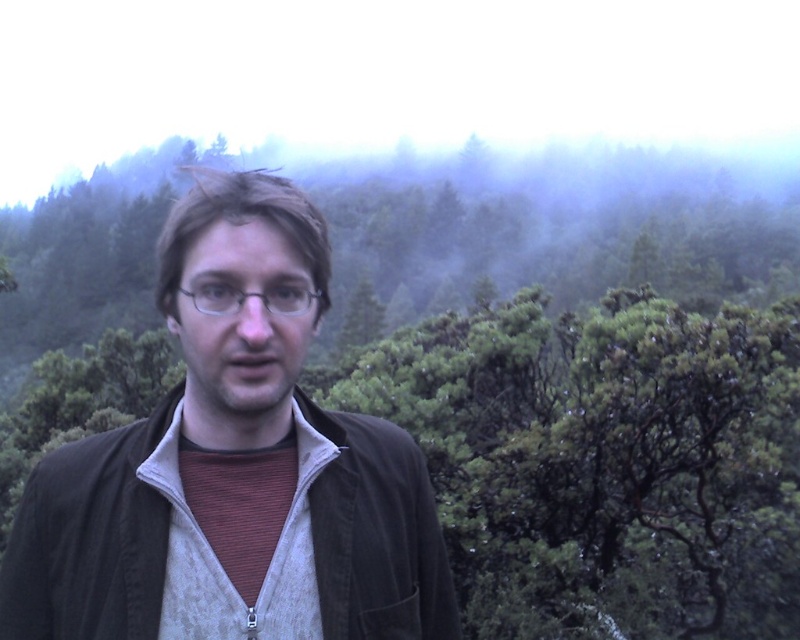
Question: Does brown fabric jacket at center appear over transparent plastic glasses at center?

Choices:
 (A) no
 (B) yes

Answer: (A)

Question: Which of the following is the farthest from the observer?

Choices:
 (A) (224, 387)
 (B) (200, 288)

Answer: (B)

Question: Among these points, which one is farthest from the camera?

Choices:
 (A) (248, 284)
 (B) (226, 291)

Answer: (B)

Question: Is brown fabric jacket at center closer to camera compared to transparent plastic glasses at center?

Choices:
 (A) yes
 (B) no

Answer: (B)

Question: Can you confirm if brown fabric jacket at center is thinner than transparent plastic glasses at center?

Choices:
 (A) no
 (B) yes

Answer: (A)

Question: Which of the following is the farthest from the observer?

Choices:
 (A) (252, 284)
 (B) (202, 301)

Answer: (B)